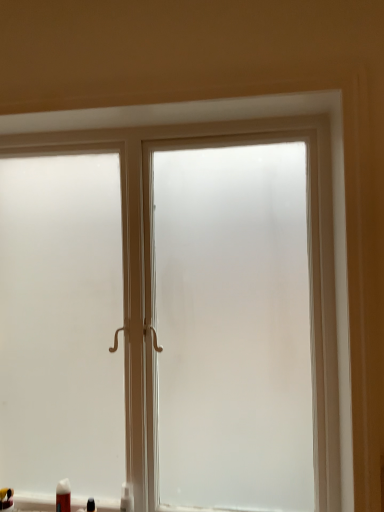
Question: Considering the relative positions of white matte tube at lower left, acting as the 2th toiletry starting from the left, and matte black toothpaste tube at lower left, the first toiletry in the left-to-right sequence, in the image provided, is white matte tube at lower left, acting as the 2th toiletry starting from the left, to the left of matte black toothpaste tube at lower left, the first toiletry in the left-to-right sequence, from the viewer's perspective?

Choices:
 (A) yes
 (B) no

Answer: (B)

Question: Can we say white matte tube at lower left, positioned as the 3th toiletry in right-to-left order, lies outside matte black toothpaste tube at lower left, which is the fourth toiletry from right to left?

Choices:
 (A) yes
 (B) no

Answer: (A)

Question: From a real-world perspective, does white matte tube at lower left, acting as the 2th toiletry starting from the left, sit lower than matte black toothpaste tube at lower left, which is the fourth toiletry from right to left?

Choices:
 (A) no
 (B) yes

Answer: (A)

Question: Does white matte tube at lower left, acting as the 2th toiletry starting from the left, have a lesser width compared to matte black toothpaste tube at lower left, which is the fourth toiletry from right to left?

Choices:
 (A) no
 (B) yes

Answer: (B)

Question: From a real-world perspective, does white matte tube at lower left, acting as the 2th toiletry starting from the left, stand above matte black toothpaste tube at lower left, the first toiletry in the left-to-right sequence?

Choices:
 (A) no
 (B) yes

Answer: (B)

Question: Is white matte tube at lower left, positioned as the 3th toiletry in right-to-left order, situated inside matte black toothpaste tube at lower left, the first toiletry in the left-to-right sequence, or outside?

Choices:
 (A) outside
 (B) inside

Answer: (A)

Question: Considering the positions of white matte tube at lower left, acting as the 2th toiletry starting from the left, and matte black toothpaste tube at lower left, which is the fourth toiletry from right to left, in the image, is white matte tube at lower left, acting as the 2th toiletry starting from the left, wider or thinner than matte black toothpaste tube at lower left, which is the fourth toiletry from right to left,?

Choices:
 (A) wide
 (B) thin

Answer: (B)

Question: From their relative heights in the image, would you say white matte tube at lower left, positioned as the 3th toiletry in right-to-left order, is taller or shorter than matte black toothpaste tube at lower left, the first toiletry in the left-to-right sequence?

Choices:
 (A) short
 (B) tall

Answer: (B)

Question: From the image's perspective, relative to matte black toothpaste tube at lower left, the first toiletry in the left-to-right sequence, is white matte tube at lower left, positioned as the 3th toiletry in right-to-left order, above or below?

Choices:
 (A) below
 (B) above

Answer: (B)

Question: Considering the positions of white plastic bottle at lower left, acting as the 1th toiletry starting from the right, and white matte tube at lower left, positioned as the 3th toiletry in right-to-left order, in the image, is white plastic bottle at lower left, acting as the 1th toiletry starting from the right, taller or shorter than white matte tube at lower left, positioned as the 3th toiletry in right-to-left order,?

Choices:
 (A) tall
 (B) short

Answer: (B)

Question: From a real-world perspective, is white plastic bottle at lower left, which is counted as the fourth toiletry, starting from the left, positioned above or below white matte tube at lower left, positioned as the 3th toiletry in right-to-left order?

Choices:
 (A) above
 (B) below

Answer: (B)

Question: From the image's perspective, is white plastic bottle at lower left, acting as the 1th toiletry starting from the right, located above or below white matte tube at lower left, positioned as the 3th toiletry in right-to-left order?

Choices:
 (A) above
 (B) below

Answer: (B)

Question: Is white plastic bottle at lower left, which is counted as the fourth toiletry, starting from the left, situated inside white matte tube at lower left, acting as the 2th toiletry starting from the left, or outside?

Choices:
 (A) outside
 (B) inside

Answer: (A)

Question: From their relative heights in the image, would you say matte black toothpaste tube at lower left, the first toiletry in the left-to-right sequence, is taller or shorter than frosted glass window at center?

Choices:
 (A) tall
 (B) short

Answer: (B)

Question: Is matte black toothpaste tube at lower left, the first toiletry in the left-to-right sequence, bigger or smaller than frosted glass window at center?

Choices:
 (A) small
 (B) big

Answer: (A)